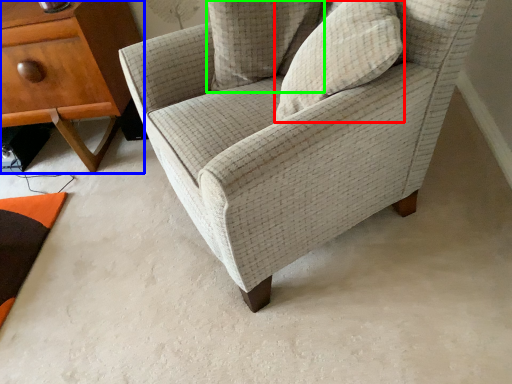
Question: Based on their relative distances, which object is nearer to pillow (highlighted by a red box)? Choose from nightstand (highlighted by a blue box) and pillow (highlighted by a green box).

Choices:
 (A) nightstand
 (B) pillow

Answer: (B)